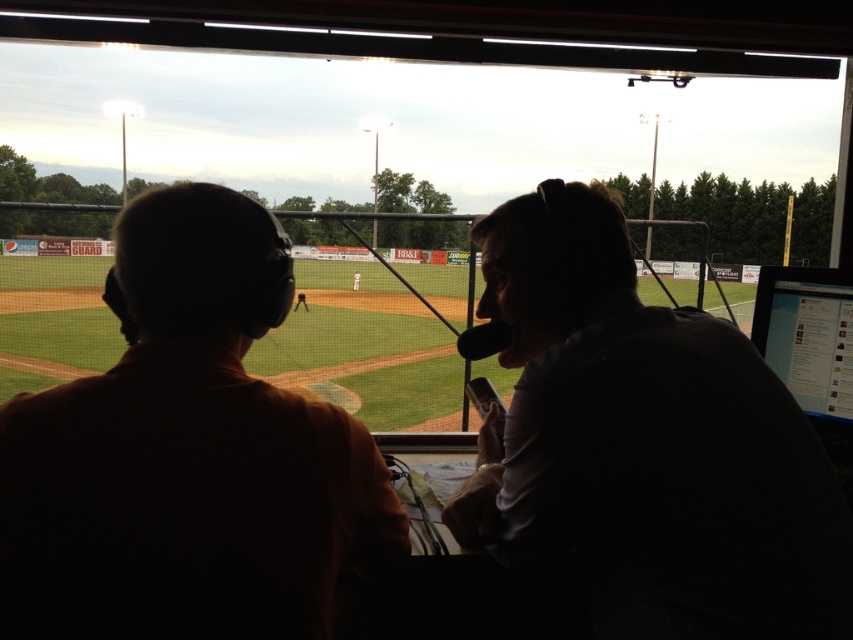
You are a photographer standing at the camera position. You want to take a closeup photo of the silhouette shirt at right. Do you need to move closer or farther away from the current position?

The silhouette shirt at right is 38.41 inches from camera, so to take a closeup photo, you need to move closer to the silhouette shirt at right to reduce the distance below 38.41 inches.

You are a technician in the broadcast booth and need to adjust the height of the orange cotton shirt at left and the black glossy monitor at right so that they are level. Which object should you raise or lower, and by how much?

The orange cotton shirt at left is taller than the black glossy monitor at right. To make them level, you should lower the orange cotton shirt at left by the difference in their heights or raise the black glossy monitor at right by the same amount.

You are a camera operator in the broadcast booth. You need to zoom in on the silhouette shirt at right located at point [645,445]. What object is at that point?

The silhouette shirt at right is located at point [645,445].